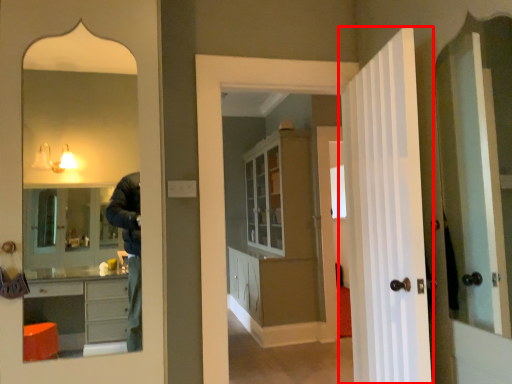
Question: In this image, where is door (annotated by the red box) located relative to dresser?

Choices:
 (A) left
 (B) right

Answer: (B)